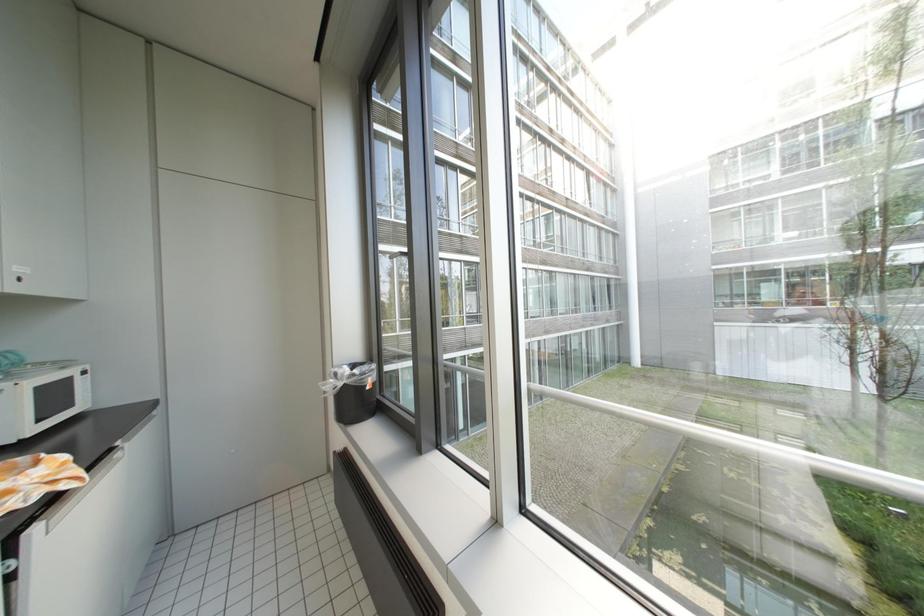
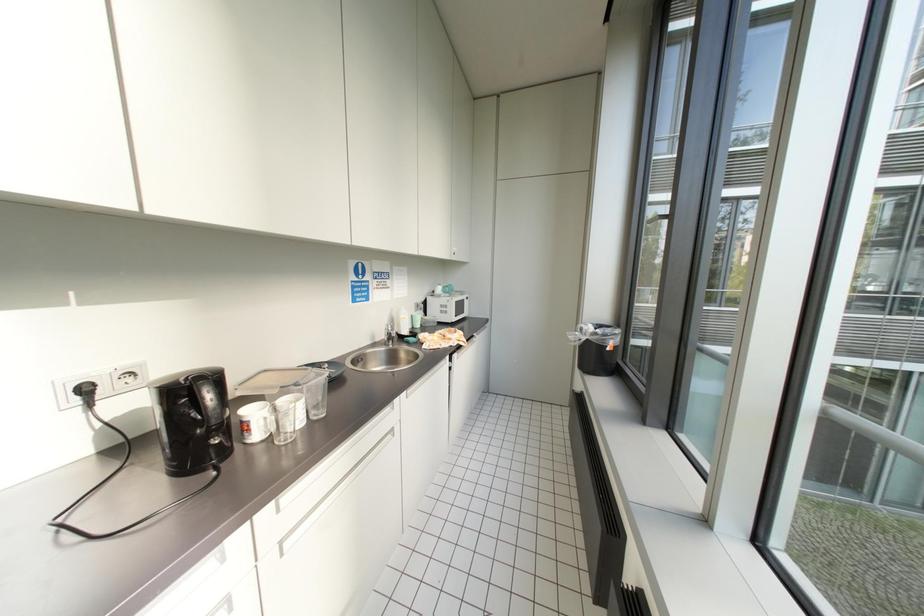
Question: The first image is from the beginning of the video and the second image is from the end. How did the camera likely rotate when shooting the video?

Choices:
 (A) Left
 (B) Right
 (C) Up
 (D) Down

Answer: (A)